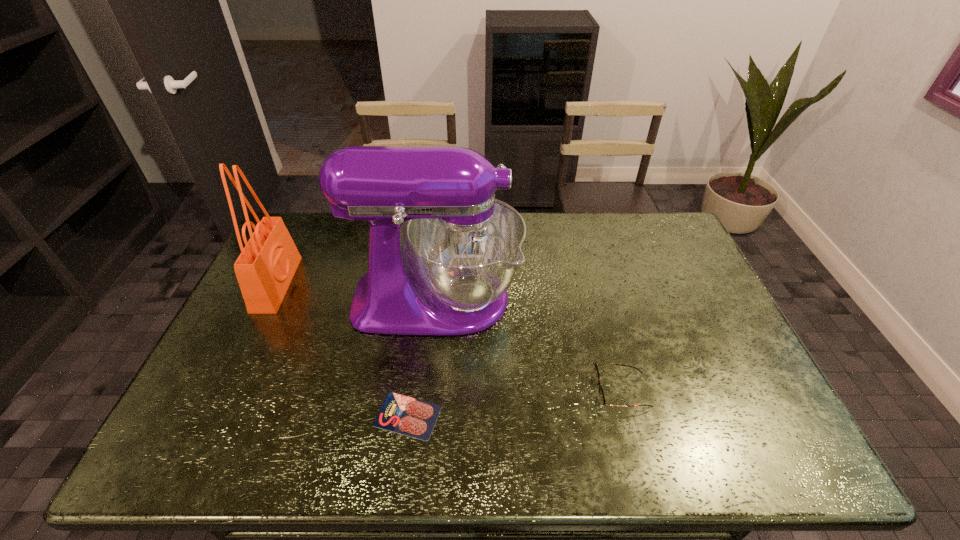
Identify the location of free space located on the face of the spectacles. This screenshot has height=540, width=960. [x=533, y=392].

This screenshot has width=960, height=540. In order to click on vacant space situated on the back of the salami in this screenshot , I will do `click(416, 356)`.

Locate an element on the screen. This screenshot has width=960, height=540. object present at the near edge is located at coordinates (401, 414).

This screenshot has height=540, width=960. Identify the location of object located in the left edge section of the desktop. (265, 268).

The width and height of the screenshot is (960, 540). I want to click on vacant point at the far edge, so point(598,223).

In the image, there is a desktop. Where is `vacant space at the left edge`? vacant space at the left edge is located at coordinates (245, 334).

Find the location of a particular element. vacant space at the right edge is located at coordinates (778, 422).

You are a GUI agent. You are given a task and a screenshot of the screen. Output one action in this format:
    pyautogui.click(x=<x>, y=<y>)
    Task: Click on the vacant space at the far right corner of the desktop
    
    Given the screenshot: What is the action you would take?
    pyautogui.click(x=672, y=232)

Find the location of a particular element. The width and height of the screenshot is (960, 540). vacant space in between the rightmost object and the mixer is located at coordinates (529, 346).

Locate an element on the screen. empty space that is in between the spectacles and the salami is located at coordinates (515, 403).